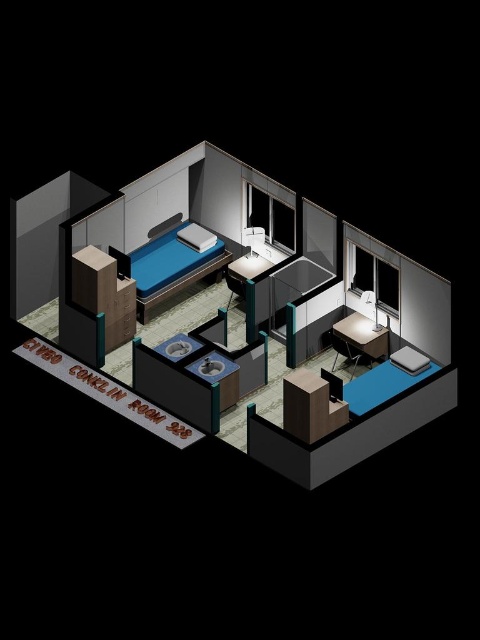
Is wooden cabinet at lower left bigger than wooden desk at center?

Yes, wooden cabinet at lower left is bigger than wooden desk at center.

The height and width of the screenshot is (640, 480). What do you see at coordinates (105, 292) in the screenshot? I see `wooden cabinet at lower left` at bounding box center [105, 292].

Locate an element on the screen. Image resolution: width=480 pixels, height=640 pixels. wooden cabinet at lower left is located at coordinates (105, 292).

Is wooden desk at center shorter than matte black desk at center?

No, wooden desk at center is not shorter than matte black desk at center.

Between wooden desk at center and matte black desk at center, which one is positioned higher?

Positioned higher is matte black desk at center.

Is point (313, 426) in front of point (350, 362)?

Yes.

Find the location of a particular element. wooden desk at center is located at coordinates (312, 404).

Is point (83, 266) positioned in front of point (338, 349)?

Yes, point (83, 266) is in front of point (338, 349).

Does point (96, 310) come behind point (336, 330)?

That is False.

Between point (107, 324) and point (354, 316), which one is positioned in front?

Point (107, 324) is more forward.

Find the location of a particular element. Image resolution: width=480 pixels, height=640 pixels. wooden cabinet at lower left is located at coordinates [105, 292].